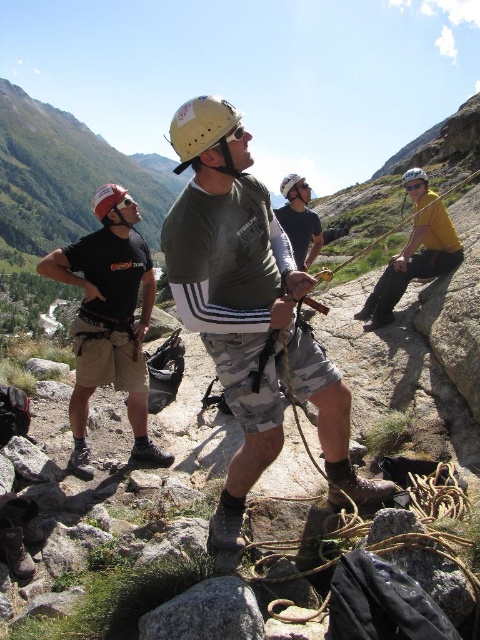
You are a hiker planning to set up a safety line between the matte green shirt at center and the matte white helmet at upper right. The safety line requires a minimum of 40 feet of rope to secure both points. Do you have enough rope available from the coiled rope near the person in the center?

The distance between the matte green shirt at center and the matte white helmet at upper right is 41.53 feet. The coiled rope near the person in the center is part of the climbing equipment, so it should be sufficient to provide the required 40 feet of rope for the safety line.